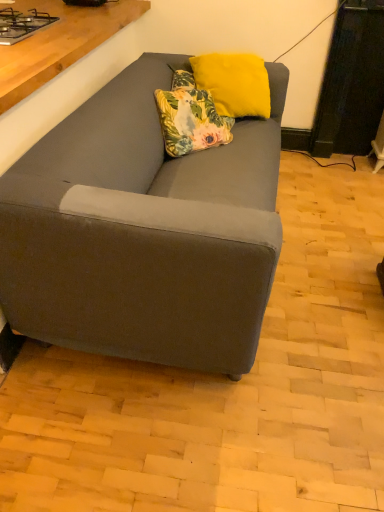
Question: Does metallic gray gas stove at upper left come behind floral fabric pillow at center, placed as the 1th pillow when sorted from bottom to top?

Choices:
 (A) no
 (B) yes

Answer: (A)

Question: Is metallic gray gas stove at upper left thinner than floral fabric pillow at center, placed as the 1th pillow when sorted from bottom to top?

Choices:
 (A) no
 (B) yes

Answer: (A)

Question: Is metallic gray gas stove at upper left facing towards floral fabric pillow at center, placed as the 1th pillow when sorted from bottom to top?

Choices:
 (A) no
 (B) yes

Answer: (A)

Question: From a real-world perspective, is metallic gray gas stove at upper left on top of floral fabric pillow at center, placed as the 1th pillow when sorted from bottom to top?

Choices:
 (A) no
 (B) yes

Answer: (B)

Question: Can you confirm if metallic gray gas stove at upper left is wider than floral fabric pillow at center, placed as the 1th pillow when sorted from bottom to top?

Choices:
 (A) no
 (B) yes

Answer: (B)

Question: Could floral fabric pillow at center, placed as the 1th pillow when sorted from bottom to top, be considered to be inside metallic gray gas stove at upper left?

Choices:
 (A) yes
 (B) no

Answer: (B)

Question: Does metallic gray gas stove at upper left appear on the right side of yellow fuzzy pillow at upper center, the second pillow ordered from the bottom?

Choices:
 (A) no
 (B) yes

Answer: (A)

Question: Can you confirm if metallic gray gas stove at upper left is wider than yellow fuzzy pillow at upper center, the second pillow ordered from the bottom?

Choices:
 (A) no
 (B) yes

Answer: (B)

Question: From a real-world perspective, is metallic gray gas stove at upper left located beneath yellow fuzzy pillow at upper center, the second pillow ordered from the bottom?

Choices:
 (A) yes
 (B) no

Answer: (B)

Question: Is the depth of metallic gray gas stove at upper left less than that of yellow fuzzy pillow at upper center, which is the 1th pillow in top-to-bottom order?

Choices:
 (A) yes
 (B) no

Answer: (A)

Question: Does metallic gray gas stove at upper left have a smaller size compared to yellow fuzzy pillow at upper center, the second pillow ordered from the bottom?

Choices:
 (A) yes
 (B) no

Answer: (A)

Question: Would you say metallic gray gas stove at upper left contains yellow fuzzy pillow at upper center, the second pillow ordered from the bottom?

Choices:
 (A) no
 (B) yes

Answer: (A)

Question: From the image's perspective, is floral fabric pillow at center, placed as the 2th pillow when sorted from top to bottom, on metallic gray gas stove at upper left?

Choices:
 (A) yes
 (B) no

Answer: (B)